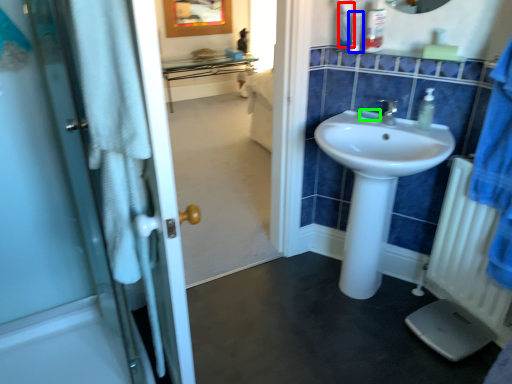
Question: Which is nearer to the toiletry (highlighted by a red box)? toiletry (highlighted by a blue box) or soap (highlighted by a green box).

Choices:
 (A) toiletry
 (B) soap

Answer: (A)